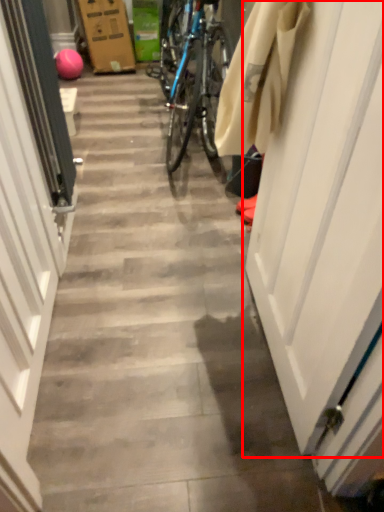
Question: From the image's perspective, where is door (annotated by the red box) located relative to door?

Choices:
 (A) above
 (B) below

Answer: (A)